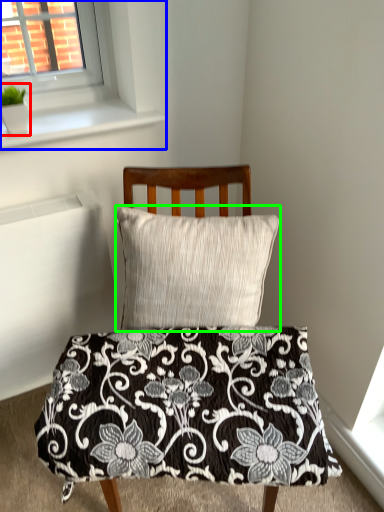
Question: Which object is the farthest from plant (highlighted by a red box)? Choose among these: window (highlighted by a blue box) or pillow (highlighted by a green box).

Choices:
 (A) window
 (B) pillow

Answer: (B)